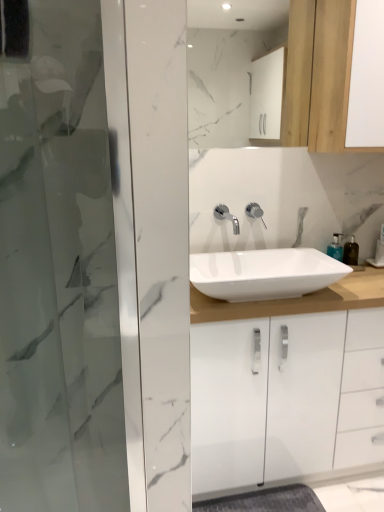
Question: Considering the positions of white marble mirror at upper center and translucent plastic soap dispenser at right, the first soap dispenser positioned from the left, in the image, is white marble mirror at upper center wider or thinner than translucent plastic soap dispenser at right, the first soap dispenser positioned from the left,?

Choices:
 (A) thin
 (B) wide

Answer: (A)

Question: From the image's perspective, relative to translucent plastic soap dispenser at right, the first soap dispenser positioned from the left, is white marble mirror at upper center above or below?

Choices:
 (A) below
 (B) above

Answer: (B)

Question: Estimate the real-world distances between objects in this image. Which object is closer to the wooden cabinet at upper right?

Choices:
 (A) transparent glass screen door at left
 (B) polished chrome faucet at center, the first tap from the left
 (C) polished chrome faucet at center, arranged as the 1th tap when viewed from the right
 (D) translucent plastic soap dispenser at right, the first soap dispenser positioned from the left
 (E) white glossy sink at center

Answer: (C)

Question: Which is farther from the polished chrome faucet at center, arranged as the 1th tap when viewed from the right?

Choices:
 (A) polished chrome faucet at center, which ranks as the second tap in right-to-left order
 (B) wooden cabinet at upper right
 (C) white glossy sink at center
 (D) white marble mirror at upper center
 (E) translucent plastic soap dispenser at right, the first soap dispenser positioned from the left

Answer: (D)